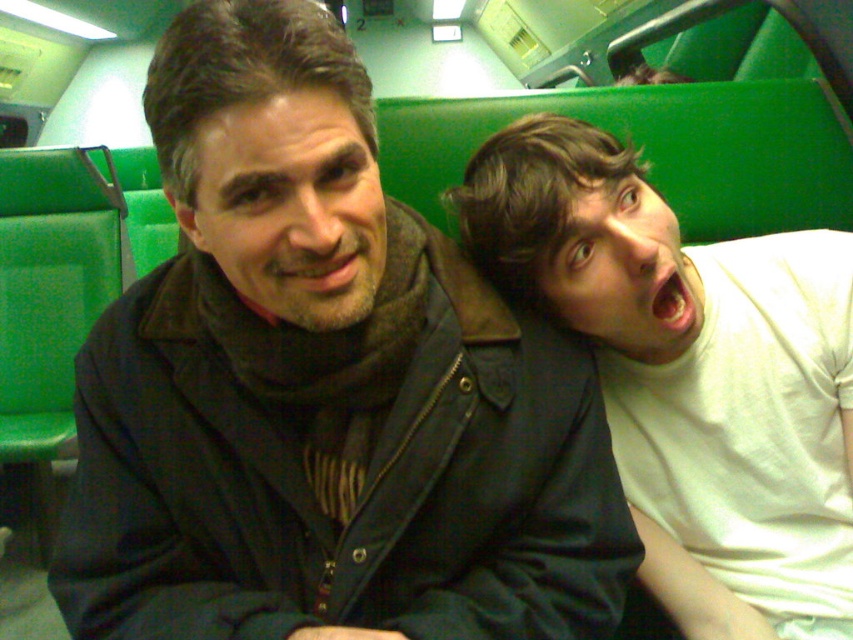
Question: Is dark blue jacket at center thinner than white matte shirt at right?

Choices:
 (A) no
 (B) yes

Answer: (A)

Question: Which point is closer to the camera?

Choices:
 (A) dark blue jacket at center
 (B) white matte shirt at right

Answer: (A)

Question: Does dark blue jacket at center appear on the right side of white matte shirt at right?

Choices:
 (A) yes
 (B) no

Answer: (B)

Question: Does dark blue jacket at center appear under white matte shirt at right?

Choices:
 (A) yes
 (B) no

Answer: (B)